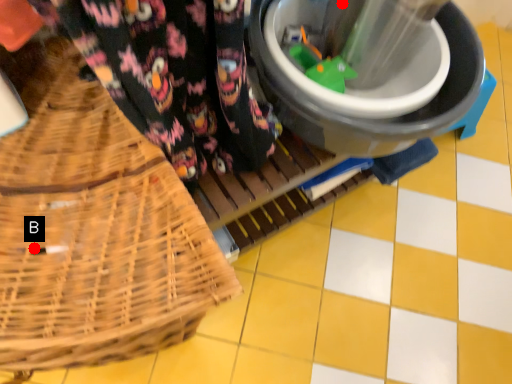
Question: Two points are circled on the image, labeled by A and B beside each circle. Which point is closer to the camera taking this photo?

Choices:
 (A) A is closer
 (B) B is closer

Answer: (B)